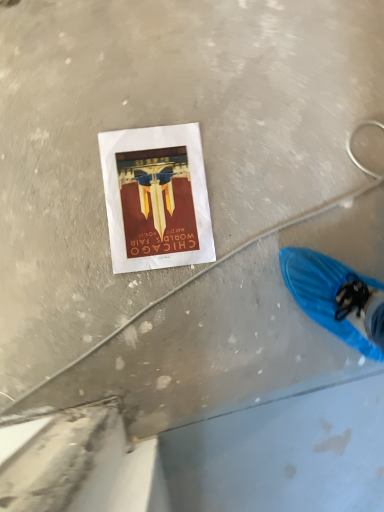
This screenshot has height=512, width=384. I want to click on vacant area that is in front of matte paper poster at center, so click(x=145, y=308).